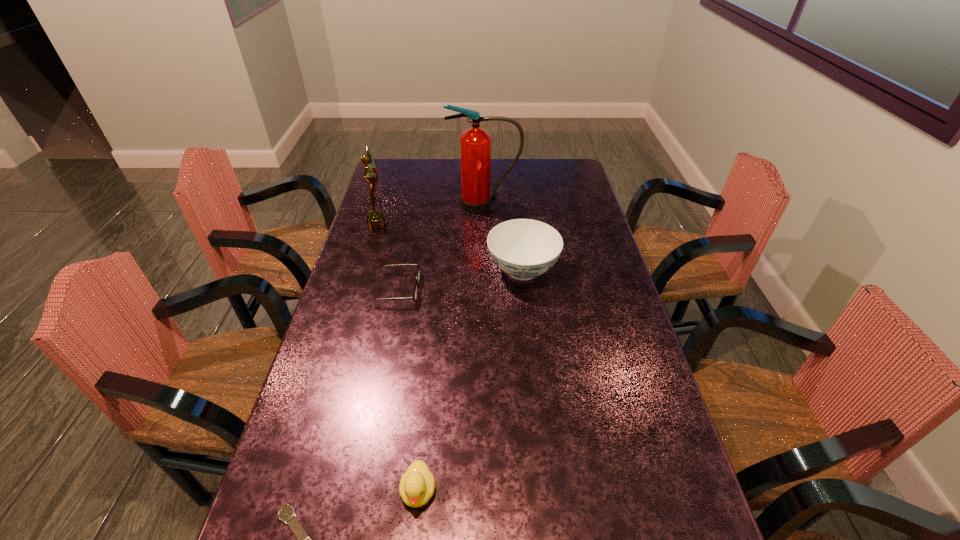
You are a GUI agent. You are given a task and a screenshot of the screen. Output one action in this format:
    pyautogui.click(x=<x>, y=<y>)
    Task: Click on the vacant space that's between the chinaware and the fifth tallest object
    
    Given the screenshot: What is the action you would take?
    pyautogui.click(x=461, y=279)

This screenshot has width=960, height=540. I want to click on free spot between the farthest object and the fifth tallest object, so click(x=442, y=247).

Where is `free spot between the chinaware and the spectacles`? The height and width of the screenshot is (540, 960). free spot between the chinaware and the spectacles is located at coordinates (461, 279).

Where is `vacant space that's between the chinaware and the fifth shortest object`? vacant space that's between the chinaware and the fifth shortest object is located at coordinates (449, 247).

The image size is (960, 540). What are the coordinates of `the second closest object to the fifth tallest object` in the screenshot? It's located at (375, 220).

Choose which object is the second nearest neighbor to the farthest object. Please provide its 2D coordinates. Your answer should be formatted as a tuple, i.e. [(x, y)], where the tuple contains the x and y coordinates of a point satisfying the conditions above.

[(375, 220)]

I want to click on free space that satisfies the following two spatial constraints: 1. on the front side of the third tallest object; 2. on the front-facing side of the fifth tallest object, so click(x=525, y=289).

Locate an element on the screen. free space that satisfies the following two spatial constraints: 1. on the back side of the third tallest object; 2. on the front-facing side of the second farthest object is located at coordinates (517, 225).

This screenshot has width=960, height=540. I want to click on free spot that satisfies the following two spatial constraints: 1. on the front side of the fire extinguisher; 2. on the front-facing side of the fourth object from right to left, so click(x=486, y=289).

In order to click on blank space that satisfies the following two spatial constraints: 1. on the front side of the chinaware; 2. on the front-facing side of the fifth tallest object in this screenshot , I will do `click(525, 289)`.